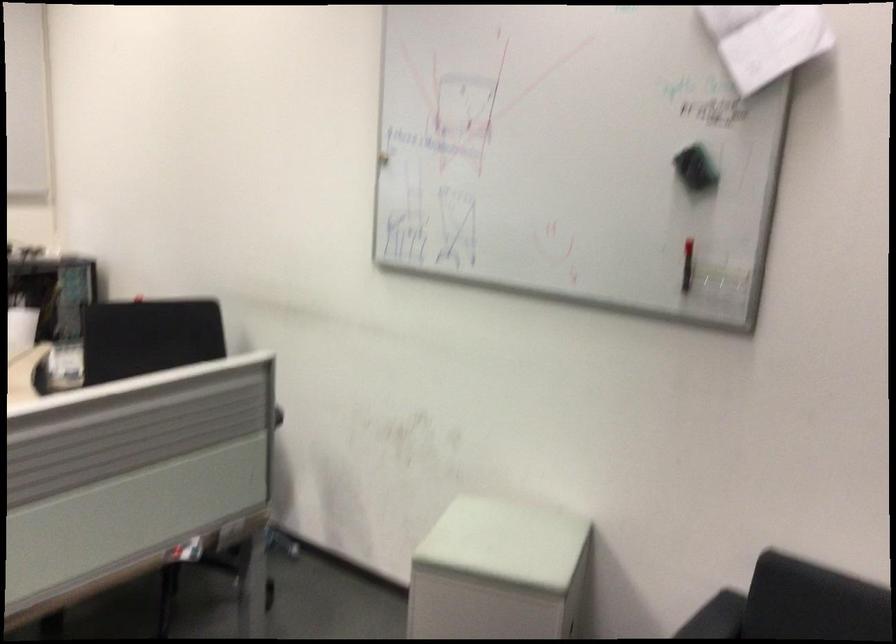
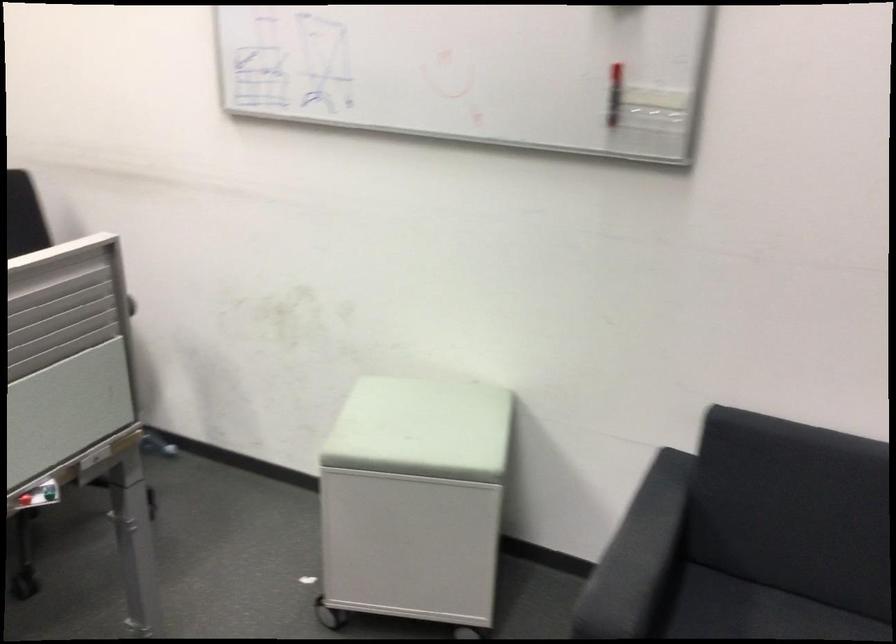
Question: Which direction would the cameraman need to move to produce the second image? Reply with the corresponding letter.

Choices:
 (A) Left
 (B) Right
 (C) Forward
 (D) Backward

Answer: (C)